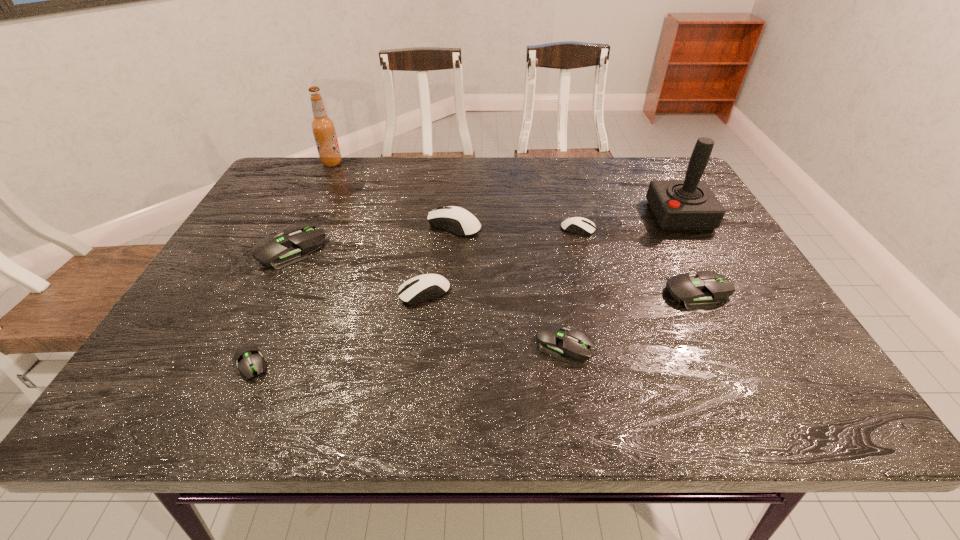
You are a GUI agent. You are given a task and a screenshot of the screen. Output one action in this format:
    pyautogui.click(x=<x>, y=<y>)
    Task: Click on the beer bottle
    The height and width of the screenshot is (540, 960).
    Given the screenshot: What is the action you would take?
    pyautogui.click(x=323, y=127)

Find the location of a particular element. The image size is (960, 540). joystick is located at coordinates (x=689, y=204).

This screenshot has height=540, width=960. In order to click on the tallest computer mouse in this screenshot , I will do `click(456, 220)`.

Find the location of a particular element. This screenshot has height=540, width=960. the biggest white mouse is located at coordinates (456, 220).

Image resolution: width=960 pixels, height=540 pixels. Find the location of `the biggest gray computer mouse`. the biggest gray computer mouse is located at coordinates (295, 243).

This screenshot has width=960, height=540. I want to click on the second smallest white mouse, so click(x=413, y=291).

Locate an element on the screen. This screenshot has height=540, width=960. the rightmost gray computer mouse is located at coordinates point(696,291).

I want to click on the rightmost computer mouse, so click(x=696, y=291).

Locate an element on the screen. the rightmost white mouse is located at coordinates (578, 225).

This screenshot has height=540, width=960. I want to click on the third biggest gray computer mouse, so click(x=553, y=339).